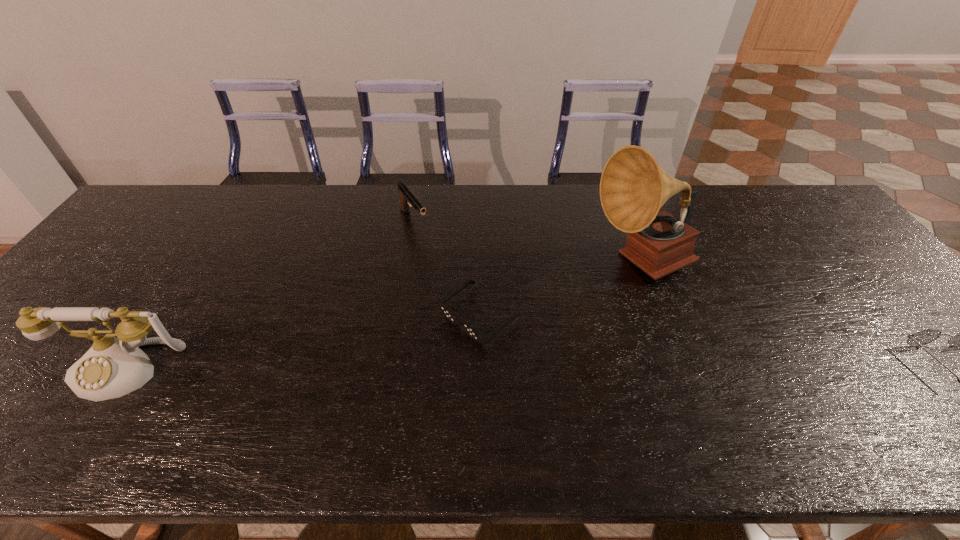
In order to click on unoccupied area between the phonograph record and the leftmost object in this screenshot , I will do `click(384, 316)`.

Identify the location of free space between the leftmost object and the tallest object. The height and width of the screenshot is (540, 960). (384, 316).

Locate which object ranks in proximity to the third shortest object. Please provide its 2D coordinates. Your answer should be formatted as a tuple, i.e. [(x, y)], where the tuple contains the x and y coordinates of a point satisfying the conditions above.

[(477, 335)]

Locate which object is the second closest to the spectacles. Please provide its 2D coordinates. Your answer should be formatted as a tuple, i.e. [(x, y)], where the tuple contains the x and y coordinates of a point satisfying the conditions above.

[(477, 335)]